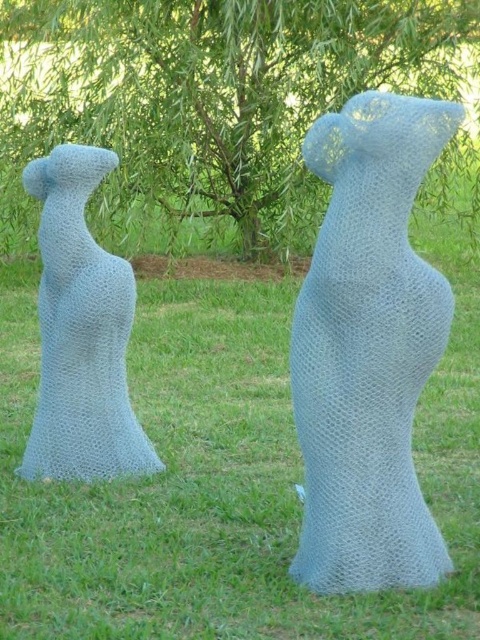
Question: Which of these objects is positioned closest to the green leafy tree at center?

Choices:
 (A) light blue mesh bear at center
 (B) textured blue sculpture at left

Answer: (B)

Question: Where is green leafy tree at center located in relation to textured blue sculpture at left in the image?

Choices:
 (A) below
 (B) above

Answer: (B)

Question: Which of these objects is positioned farthest from the light blue mesh bear at center?

Choices:
 (A) green leafy tree at center
 (B) textured blue sculpture at left

Answer: (A)

Question: Is green leafy tree at center positioned behind textured blue sculpture at left?

Choices:
 (A) yes
 (B) no

Answer: (A)

Question: Can you confirm if light blue mesh bear at center is positioned to the left of textured blue sculpture at left?

Choices:
 (A) no
 (B) yes

Answer: (A)

Question: Considering the real-world distances, which object is closest to the green leafy tree at center?

Choices:
 (A) textured blue sculpture at left
 (B) light blue mesh bear at center

Answer: (A)